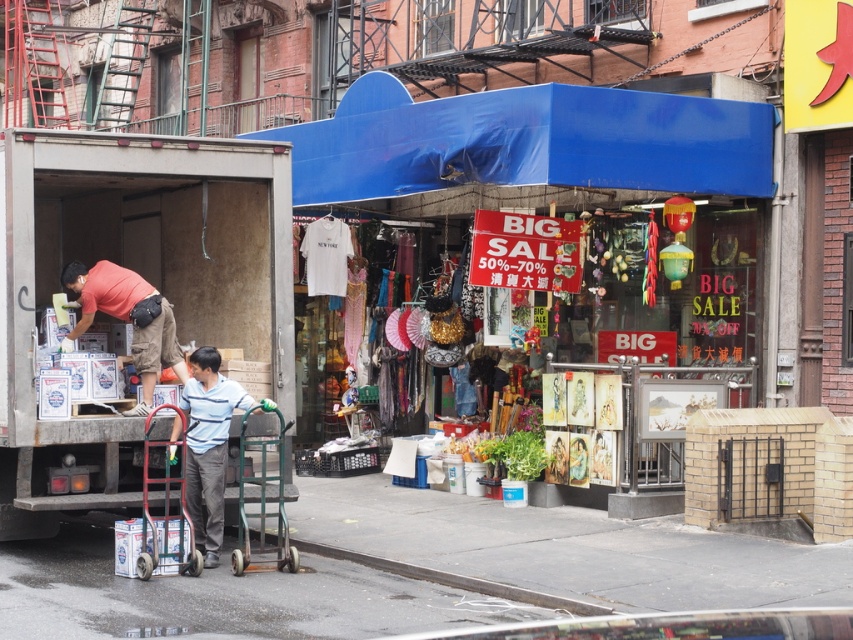
Image resolution: width=853 pixels, height=640 pixels. Describe the element at coordinates (128, 317) in the screenshot. I see `matte red shirt at left` at that location.

Who is positioned more to the left, matte red shirt at left or green metallic handcart at center?

matte red shirt at left

Who is more forward, (138, 413) or (260, 406)?

Point (260, 406)

The image size is (853, 640). In order to click on matte red shirt at left in this screenshot , I will do (128, 317).

Is point (647, 102) farther from camera compared to point (206, 547)?

That is True.

Between blue fabric awning at center and striped cotton shirt at center, which one has less height?

blue fabric awning at center

Between point (694, 108) and point (202, 516), which one is positioned in front?

Point (202, 516)

I want to click on blue fabric awning at center, so click(527, 141).

You are a GUI agent. You are given a task and a screenshot of the screen. Output one action in this format:
    pyautogui.click(x=<x>, y=<y>)
    Task: Click on the blue fabric canopy at upper center
    This screenshot has width=853, height=640.
    Given the screenshot: What is the action you would take?
    pyautogui.click(x=527, y=141)

Can you confirm if blue fabric canopy at upper center is positioned to the right of matte red shirt at left?

Yes, blue fabric canopy at upper center is to the right of matte red shirt at left.

Who is more forward, (531, 136) or (138, 342)?

Point (138, 342) is in front.

This screenshot has height=640, width=853. In order to click on blue fabric canopy at upper center in this screenshot , I will do `click(527, 141)`.